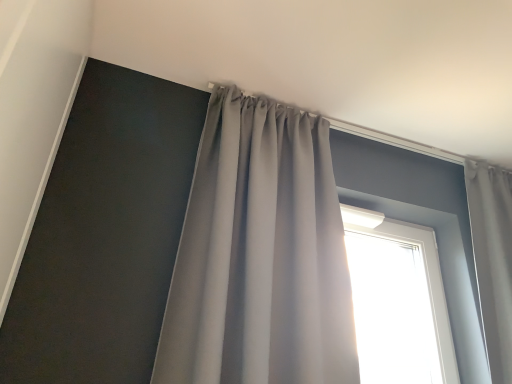
Locate an element on the screen. satin gray curtain at upper center is located at coordinates click(260, 256).

Measure the distance between satin gray curtain at upper center and camera.

The distance of satin gray curtain at upper center from camera is 38.83 inches.

Looking at this image, in order to face satin gray curtain at upper center, should I rotate leftwards or rightwards?

You should rotate right by 3.255 degrees.

Describe the element at coordinates (260, 256) in the screenshot. The image size is (512, 384). I see `satin gray curtain at upper center` at that location.

At what (x,y) coordinates should I click in order to perform the action: click on satin gray curtain at upper center. Please return your answer as a coordinate pair (x, y). Looking at the image, I should click on (260, 256).